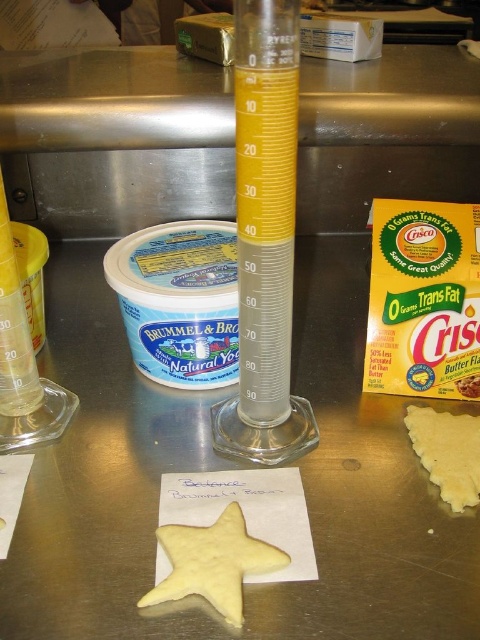
Question: Which point appears closest to the camera in this image?

Choices:
 (A) (456, 380)
 (B) (228, 536)
 (C) (443, 416)

Answer: (B)

Question: Among these points, which one is farthest from the camera?

Choices:
 (A) (453, 420)
 (B) (200, 577)

Answer: (A)

Question: Can you confirm if yellow matte star-shaped dough at center is positioned to the right of yellow matte dough at lower right?

Choices:
 (A) no
 (B) yes

Answer: (A)

Question: Is yellow matte dough at lower right below butter-flavored shortening at center?

Choices:
 (A) yes
 (B) no

Answer: (A)

Question: Estimate the real-world distances between objects in this image. Which object is farther from the yellow matte star-shaped dough at center?

Choices:
 (A) butter-flavored shortening at center
 (B) yellow matte dough at lower right

Answer: (A)

Question: Does yellow matte dough at lower right have a smaller size compared to butter-flavored shortening at center?

Choices:
 (A) no
 (B) yes

Answer: (A)